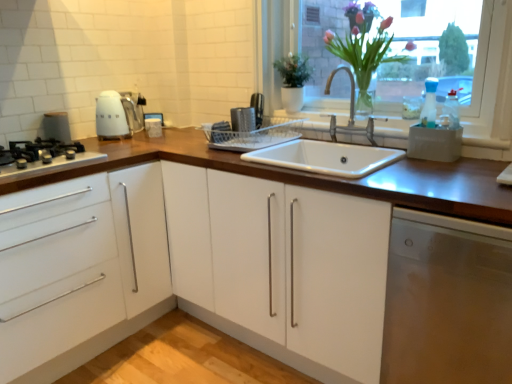
Question: From a real-world perspective, is stainless steel dishwasher at lower right beneath wooden at center?

Choices:
 (A) no
 (B) yes

Answer: (B)

Question: Considering the relative positions of stainless steel dishwasher at lower right and wooden at center in the image provided, is stainless steel dishwasher at lower right behind wooden at center?

Choices:
 (A) yes
 (B) no

Answer: (B)

Question: Is stainless steel dishwasher at lower right looking in the opposite direction of wooden at center?

Choices:
 (A) yes
 (B) no

Answer: (B)

Question: Does stainless steel dishwasher at lower right appear on the right side of wooden at center?

Choices:
 (A) yes
 (B) no

Answer: (A)

Question: Does stainless steel dishwasher at lower right have a greater width compared to wooden at center?

Choices:
 (A) yes
 (B) no

Answer: (B)

Question: In terms of width, does translucent glass vase at upper right look wider or thinner when compared to black matte gas stove at left?

Choices:
 (A) wide
 (B) thin

Answer: (B)

Question: Considering their positions, is translucent glass vase at upper right located in front of or behind black matte gas stove at left?

Choices:
 (A) front
 (B) behind

Answer: (B)

Question: From the image's perspective, relative to black matte gas stove at left, is translucent glass vase at upper right above or below?

Choices:
 (A) above
 (B) below

Answer: (A)

Question: In the image, is translucent glass vase at upper right on the left side or the right side of black matte gas stove at left?

Choices:
 (A) right
 (B) left

Answer: (A)

Question: From the image's perspective, is stainless steel dishwasher at lower right above or below white glossy kettle at upper left?

Choices:
 (A) below
 (B) above

Answer: (A)

Question: From a real-world perspective, relative to white glossy kettle at upper left, is stainless steel dishwasher at lower right vertically above or below?

Choices:
 (A) below
 (B) above

Answer: (A)

Question: From their relative heights in the image, would you say stainless steel dishwasher at lower right is taller or shorter than white glossy kettle at upper left?

Choices:
 (A) short
 (B) tall

Answer: (B)

Question: Does point (435, 281) appear closer or farther from the camera than point (136, 117)?

Choices:
 (A) farther
 (B) closer

Answer: (B)

Question: Is wooden at center wider or thinner than metallic silver dish rack at center, which appears as the first appliance when viewed from the right?

Choices:
 (A) wide
 (B) thin

Answer: (A)

Question: Is wooden at center bigger or smaller than metallic silver dish rack at center, positioned as the 2th appliance in left-to-right order?

Choices:
 (A) small
 (B) big

Answer: (B)